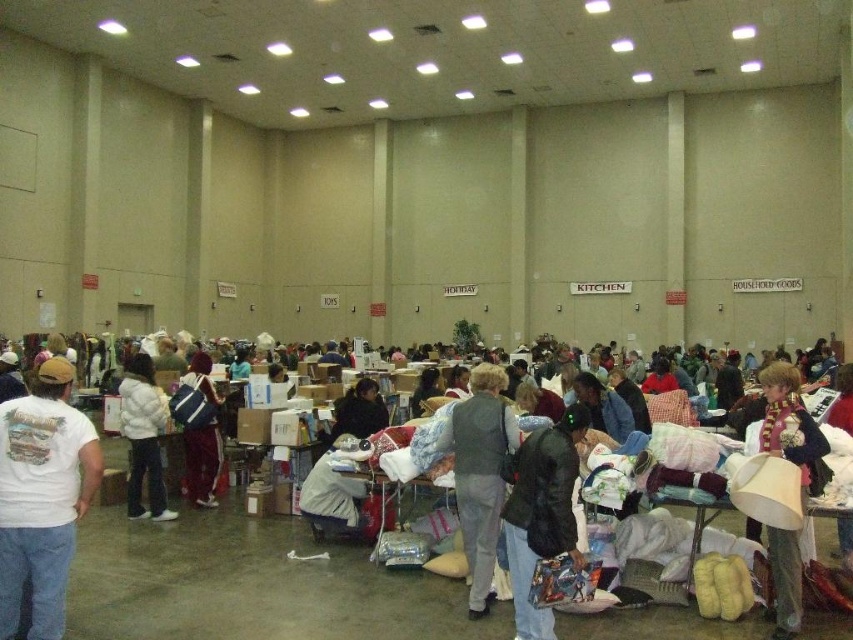
You are at a flea market and see both the dark gray jacket at center and the velvet maroon scarf at lower right. Which item is positioned more to the left?

The dark gray jacket at center is positioned more to the left than the velvet maroon scarf at lower right.

You are standing at the entrance of the convention center and see the point marked as point (201,435). What object is located at that point?

The velvet blue backpack at center is located at point (201,435).

Consider the image. You are standing in the convention center and want to know how far the point at coordinates (480, 470) is from your current position. Can you determine the distance?

The point at coordinates (480, 470) is 24.28 feet away from your current position.